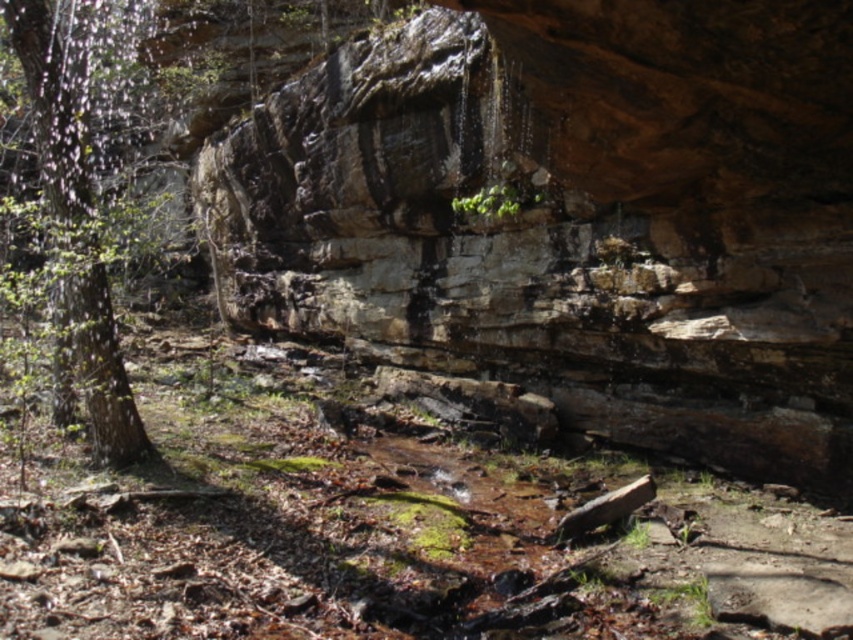
Question: Which of the following is the closest to the observer?

Choices:
 (A) green rough bark tree at left
 (B) rusty stone cliff at center

Answer: (B)

Question: Which of the following is the farthest from the observer?

Choices:
 (A) (68, 108)
 (B) (529, 330)

Answer: (B)

Question: Which object is closer to the camera taking this photo?

Choices:
 (A) green rough bark tree at left
 (B) rusty stone cliff at center

Answer: (B)

Question: Is rusty stone cliff at center thinner than green rough bark tree at left?

Choices:
 (A) no
 (B) yes

Answer: (A)

Question: Does rusty stone cliff at center appear on the left side of green rough bark tree at left?

Choices:
 (A) no
 (B) yes

Answer: (A)

Question: Does rusty stone cliff at center have a larger size compared to green rough bark tree at left?

Choices:
 (A) yes
 (B) no

Answer: (A)